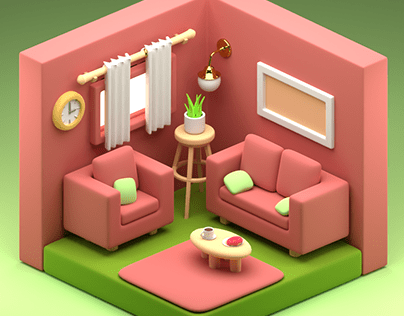
I want to click on pillows, so click(284, 183), click(268, 170), click(129, 166).